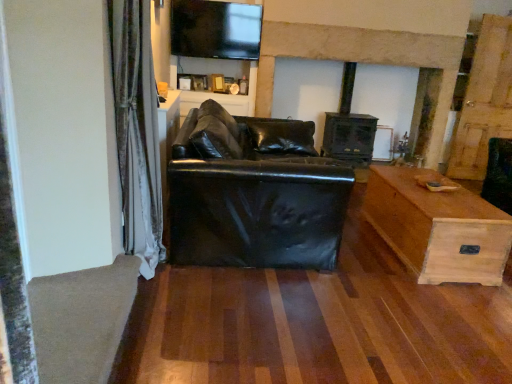
Question: From the image's perspective, is matte black entertainment center at upper center under wooden chest at right?

Choices:
 (A) yes
 (B) no

Answer: (B)

Question: Is matte black entertainment center at upper center smaller than wooden chest at right?

Choices:
 (A) no
 (B) yes

Answer: (A)

Question: Can you confirm if matte black entertainment center at upper center is shorter than wooden chest at right?

Choices:
 (A) no
 (B) yes

Answer: (A)

Question: Considering the relative positions of matte black entertainment center at upper center and wooden chest at right in the image provided, is matte black entertainment center at upper center to the left of wooden chest at right from the viewer's perspective?

Choices:
 (A) no
 (B) yes

Answer: (B)

Question: Is matte black entertainment center at upper center facing towards wooden chest at right?

Choices:
 (A) no
 (B) yes

Answer: (A)

Question: Considering the positions of black leather couch at center and matte black entertainment center at upper center in the image, is black leather couch at center taller or shorter than matte black entertainment center at upper center?

Choices:
 (A) short
 (B) tall

Answer: (A)

Question: Considering their positions, is black leather couch at center located in front of or behind matte black entertainment center at upper center?

Choices:
 (A) behind
 (B) front

Answer: (B)

Question: From the image's perspective, is black leather couch at center positioned above or below matte black entertainment center at upper center?

Choices:
 (A) below
 (B) above

Answer: (A)

Question: In terms of width, does black leather couch at center look wider or thinner when compared to matte black entertainment center at upper center?

Choices:
 (A) wide
 (B) thin

Answer: (A)

Question: Do you think dark wood fireplace at center is within matte black entertainment center at upper center, or outside of it?

Choices:
 (A) inside
 (B) outside

Answer: (B)

Question: In the image, is dark wood fireplace at center positioned in front of or behind matte black entertainment center at upper center?

Choices:
 (A) behind
 (B) front

Answer: (B)

Question: Is dark wood fireplace at center bigger or smaller than matte black entertainment center at upper center?

Choices:
 (A) small
 (B) big

Answer: (B)

Question: Does point (360, 39) appear closer or farther from the camera than point (220, 41)?

Choices:
 (A) closer
 (B) farther

Answer: (B)

Question: Is matte black entertainment center at upper center in front of or behind wooden chest at right in the image?

Choices:
 (A) front
 (B) behind

Answer: (B)

Question: Does point (240, 107) appear closer or farther from the camera than point (416, 200)?

Choices:
 (A) farther
 (B) closer

Answer: (A)